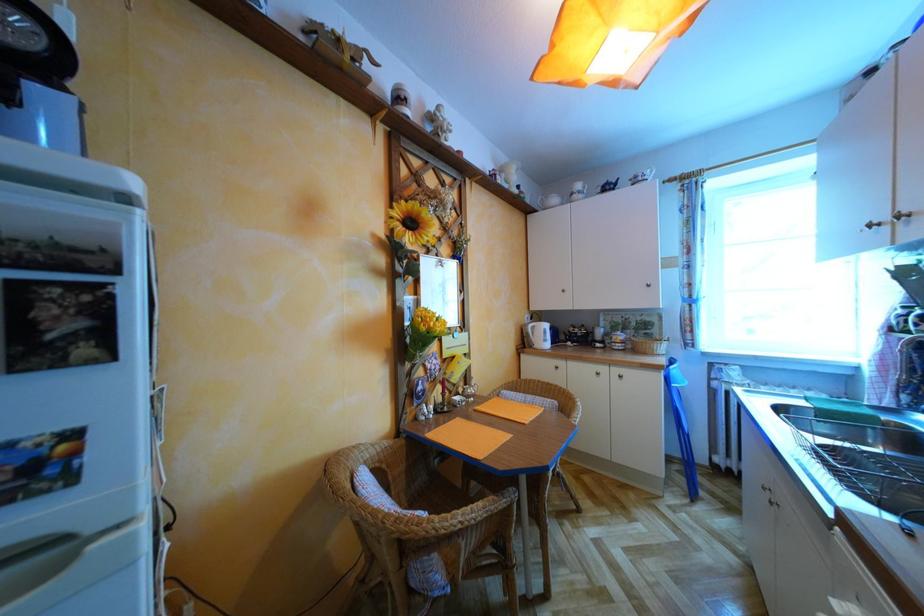
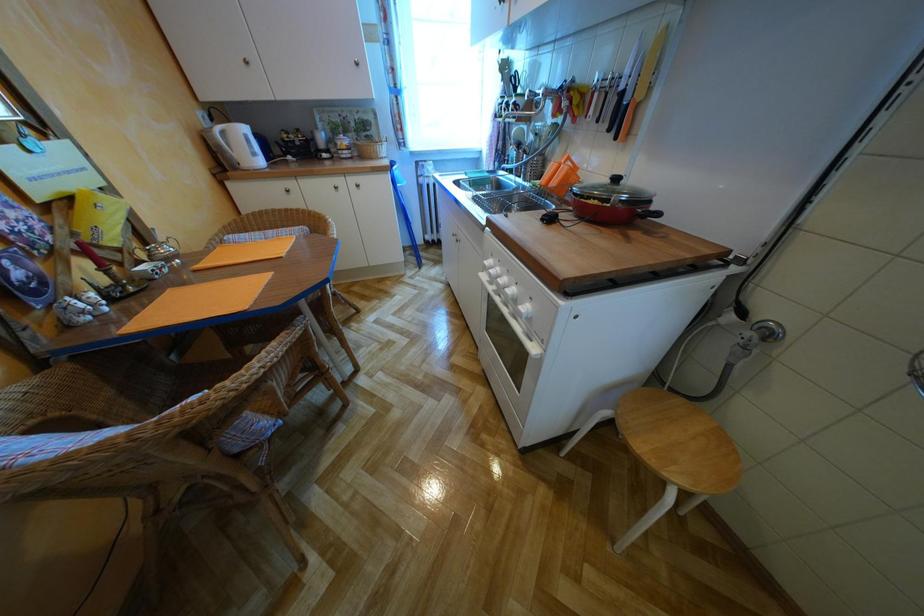
First-person continuous shooting, in which direction is the camera rotating?

The camera rotated toward right-down.